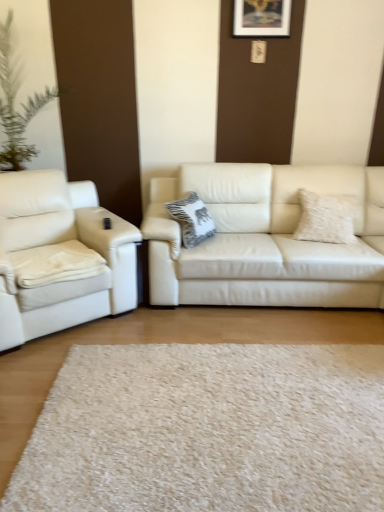
Question: From a real-world perspective, is white shag rug at center positioned above or below wooden picture frame at upper center?

Choices:
 (A) below
 (B) above

Answer: (A)

Question: Looking at the image, does white shag rug at center seem bigger or smaller compared to wooden picture frame at upper center?

Choices:
 (A) small
 (B) big

Answer: (B)

Question: Considering the real-world distances, which object is closest to the matte white couch at left, the 2th studio couch in the right-to-left sequence?

Choices:
 (A) matte white couch at center, acting as the first studio couch starting from the right
 (B) fuzzy white pillow at right, the first pillow positioned from the right
 (C) wooden picture frame at upper center
 (D) white textured pillow at center, the 1th pillow when ordered from left to right
 (E) white shag rug at center

Answer: (A)

Question: Which is nearer to the matte white couch at left, the 1th studio couch viewed from the left?

Choices:
 (A) wooden picture frame at upper center
 (B) white textured pillow at center, placed as the 2th pillow when sorted from right to left
 (C) white shag rug at center
 (D) fuzzy white pillow at right, acting as the second pillow starting from the left
 (E) matte white couch at center, acting as the second studio couch starting from the left

Answer: (E)